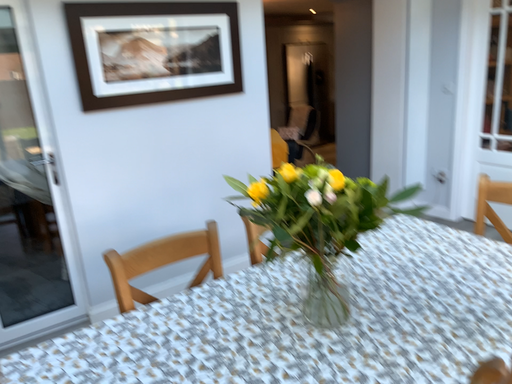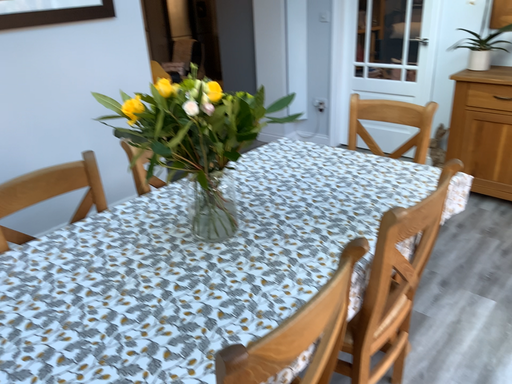
Question: How did the camera likely rotate when shooting the video?

Choices:
 (A) rotated downward
 (B) rotated upward

Answer: (A)